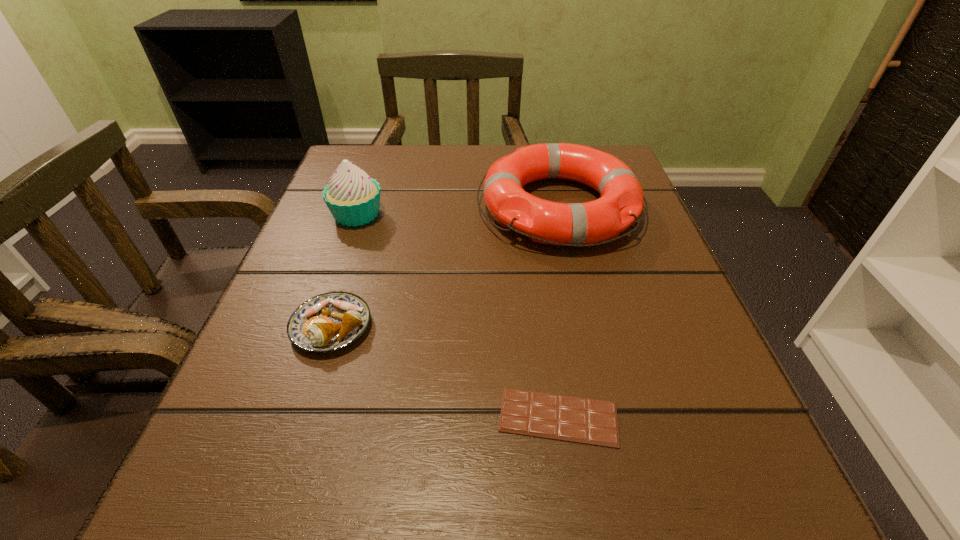
What are the coordinates of `free area in between the nearest object and the third shortest object` in the screenshot? It's located at (x=559, y=312).

The image size is (960, 540). I want to click on unoccupied area between the pastry and the third shortest object, so click(x=445, y=267).

Identify the location of empty space that is in between the cupcake and the second shortest object. (345, 271).

Image resolution: width=960 pixels, height=540 pixels. I want to click on free space between the cupcake and the third shortest object, so click(x=458, y=211).

Find the location of a particular element. This screenshot has width=960, height=540. unoccupied position between the tallest object and the pastry is located at coordinates 345,271.

What are the coordinates of `object that is the closest to the cupcake` in the screenshot? It's located at (328, 322).

You are a GUI agent. You are given a task and a screenshot of the screen. Output one action in this format:
    pyautogui.click(x=<x>, y=<y>)
    Task: Click on the object that can be found as the second closest to the chocolate bar
    This screenshot has height=540, width=960.
    Given the screenshot: What is the action you would take?
    pyautogui.click(x=575, y=224)

Identify the location of vacant area in the image that satisfies the following two spatial constraints: 1. on the back side of the chocolate bar; 2. on the left side of the life buoy. (529, 207).

Where is `free region that satisfies the following two spatial constraints: 1. on the back side of the pastry; 2. on the right side of the life buoy`? free region that satisfies the following two spatial constraints: 1. on the back side of the pastry; 2. on the right side of the life buoy is located at coordinates (370, 207).

Locate an element on the screen. Image resolution: width=960 pixels, height=540 pixels. free location that satisfies the following two spatial constraints: 1. on the front side of the tallest object; 2. on the left side of the shortest object is located at coordinates (286, 417).